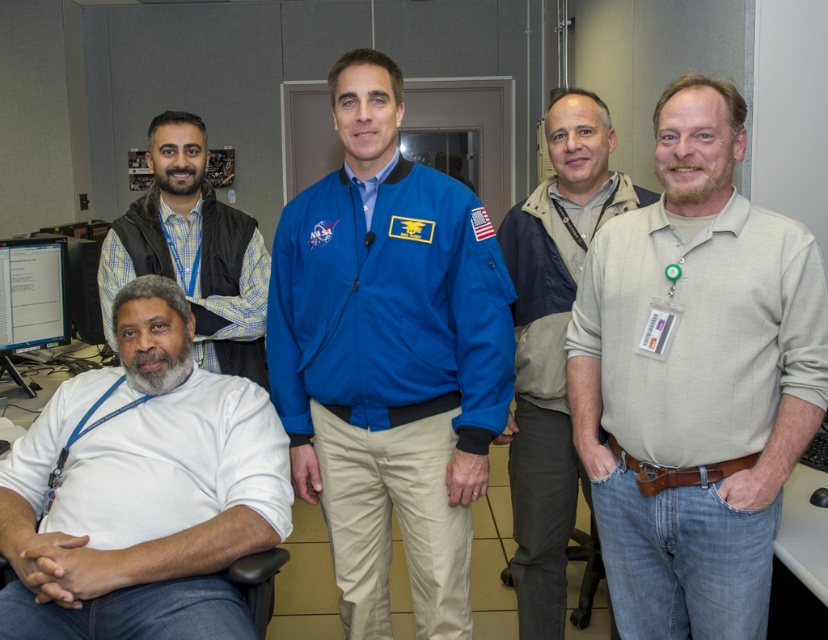
Does white matte shirt at lower left appear on the left side of black glossy monitor at lower left?

No, white matte shirt at lower left is not to the left of black glossy monitor at lower left.

Between white matte shirt at lower left and black glossy monitor at lower left, which one is positioned higher?

black glossy monitor at lower left is above.

Is point (71, 442) closer to camera compared to point (10, 273)?

Yes, it is.

Locate an element on the screen. white matte shirt at lower left is located at coordinates [x=142, y=490].

Is point (321, 390) positioned before point (559, 518)?

Yes, it is.

You are a GUI agent. You are given a task and a screenshot of the screen. Output one action in this format:
    pyautogui.click(x=<x>, y=<y>)
    Task: Click on the blue fabric jacket at center
    
    Given the screenshot: What is the action you would take?
    pyautogui.click(x=388, y=356)

Describe the element at coordinates (552, 342) in the screenshot. I see `khaki pants at center` at that location.

Locate an element on the screen. khaki pants at center is located at coordinates (552, 342).

Locate an element on the screen. This screenshot has height=640, width=828. khaki pants at center is located at coordinates (552, 342).